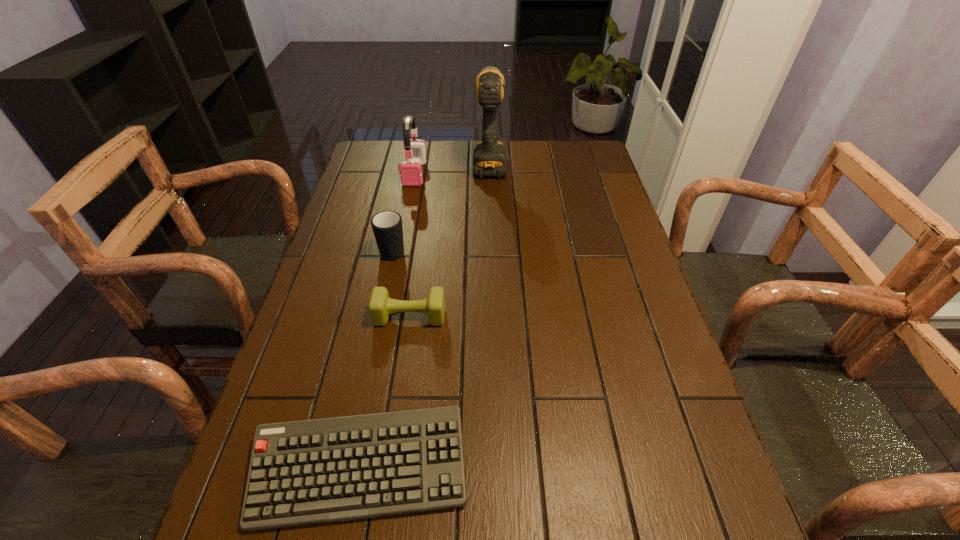
Where is `the tallest object`? the tallest object is located at coordinates pos(489,160).

Identify the location of earphone. (411, 173).

Where is `the third tallest object`? This screenshot has width=960, height=540. the third tallest object is located at coordinates (387, 227).

The width and height of the screenshot is (960, 540). Find the location of `mug`. mug is located at coordinates (387, 227).

Find the location of a particular element. The height and width of the screenshot is (540, 960). dumbbell is located at coordinates (380, 306).

Identify the location of the second nearest object. This screenshot has width=960, height=540. (380, 306).

Image resolution: width=960 pixels, height=540 pixels. I want to click on the shortest object, so click(x=305, y=472).

Identify the location of the nearest object. (305, 472).

Find the location of a particular element. The image size is (960, 540). vacant region located 0.090m on the outer surface of the earphone is located at coordinates (409, 203).

You are a GUI agent. You are given a task and a screenshot of the screen. Output one action in this format:
    pyautogui.click(x=<x>, y=<y>)
    Task: Click on the free region located on the side of the mug with the handle
    The image size is (960, 540).
    Given the screenshot: What is the action you would take?
    405,191